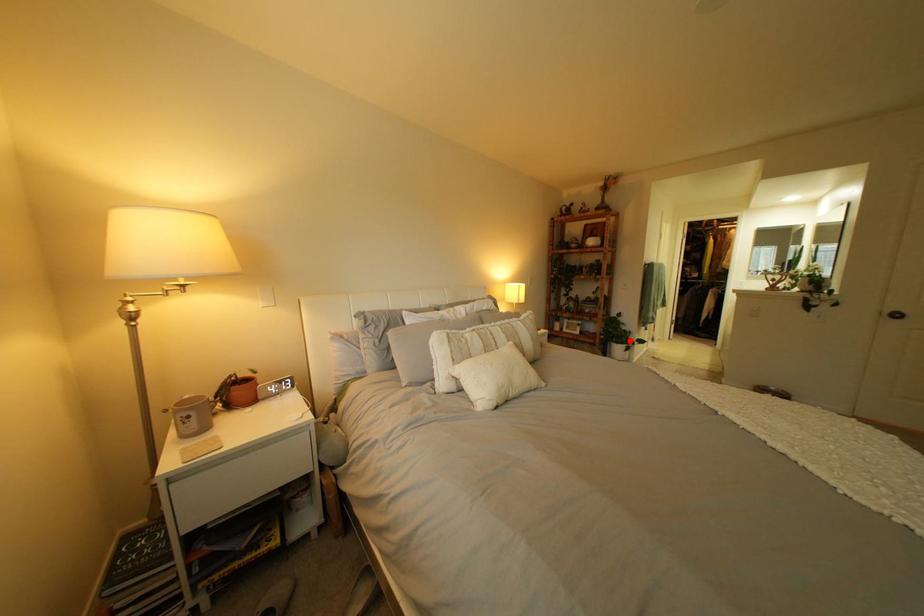
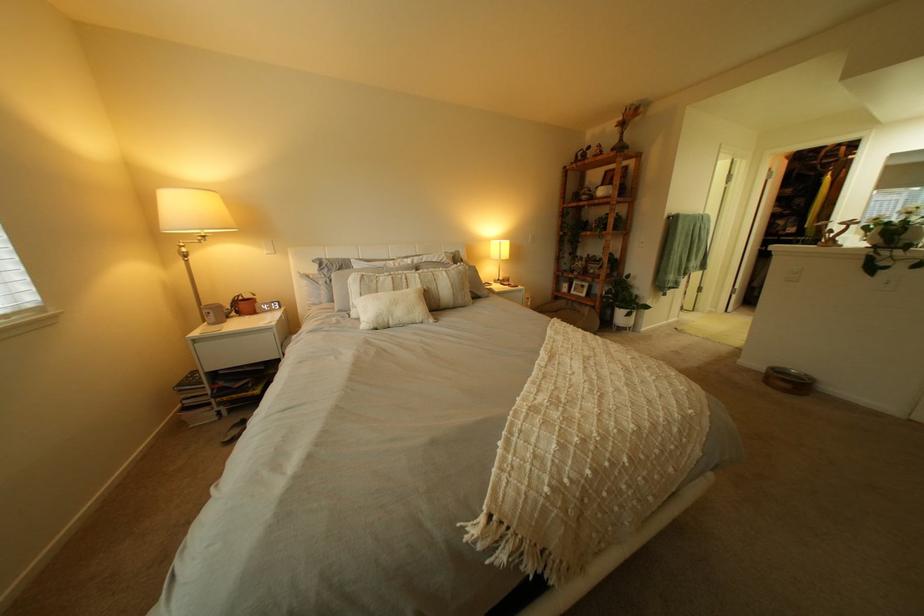
Question: I am providing you with two images of the same scene from different viewpoints. A red point is shown in image1. For the corresponding object point in image2, is it positioned nearer or farther from the camera?

Choices:
 (A) Nearer
 (B) Farther

Answer: (A)